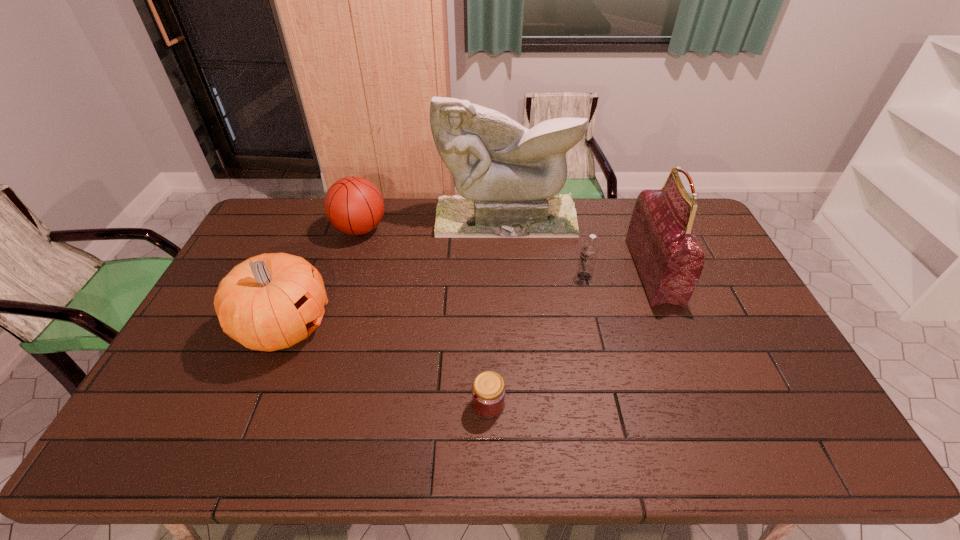
I want to click on vacant area between the basketball and the second shortest object, so click(x=472, y=253).

This screenshot has width=960, height=540. What are the coordinates of `vacant area that lies between the third tallest object and the nearest object` in the screenshot? It's located at (387, 366).

Identify the location of free space between the sculpture and the basketball. (433, 224).

Locate an element on the screen. The image size is (960, 540). free space between the basketball and the shortest object is located at coordinates (424, 316).

Where is `object that is the second closest to the tallest object`? object that is the second closest to the tallest object is located at coordinates (354, 205).

The height and width of the screenshot is (540, 960). I want to click on the third closest object to the tallest object, so click(x=589, y=251).